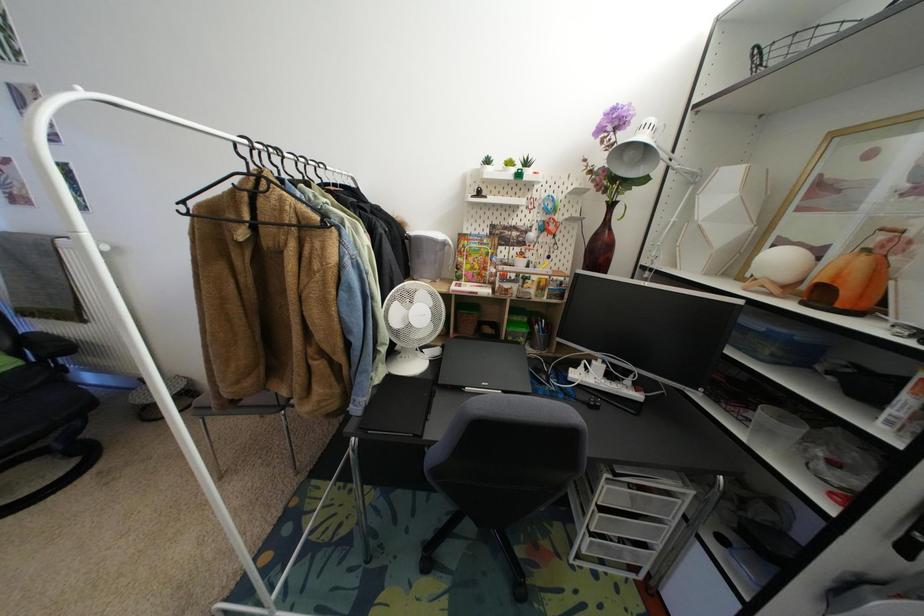
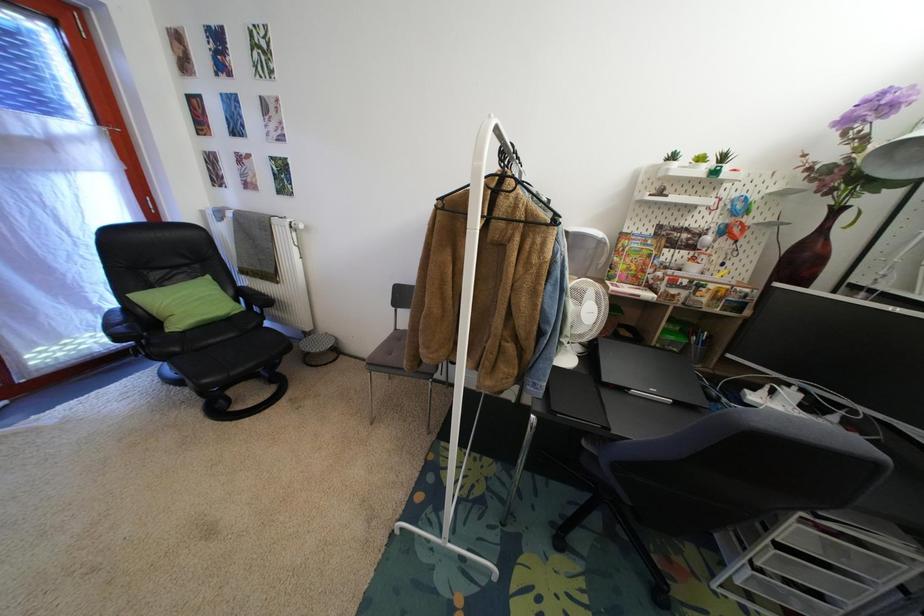
Question: Based on the continuous images, in which direction is the camera rotating? Reply with the corresponding letter.

Choices:
 (A) Left
 (B) Right
 (C) Up
 (D) Down

Answer: (A)